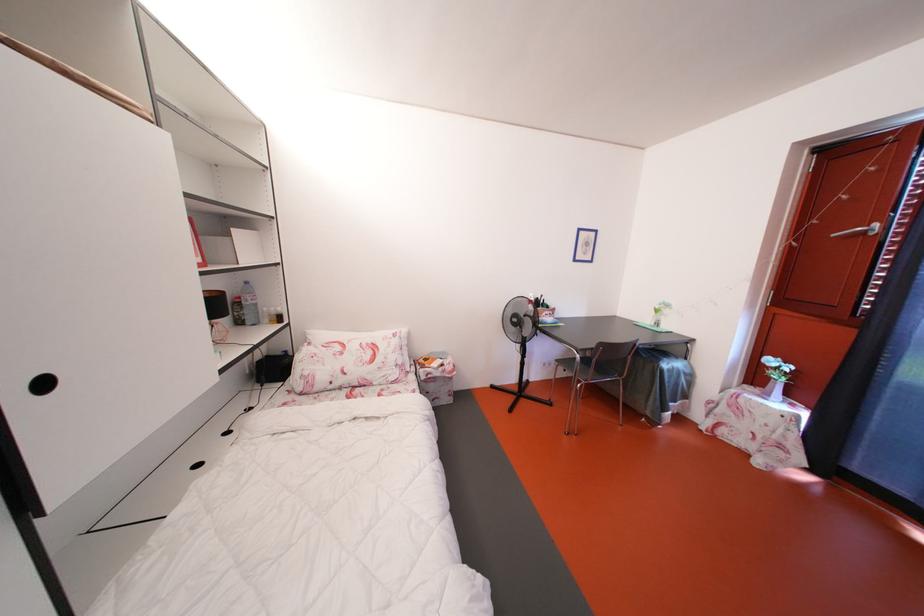
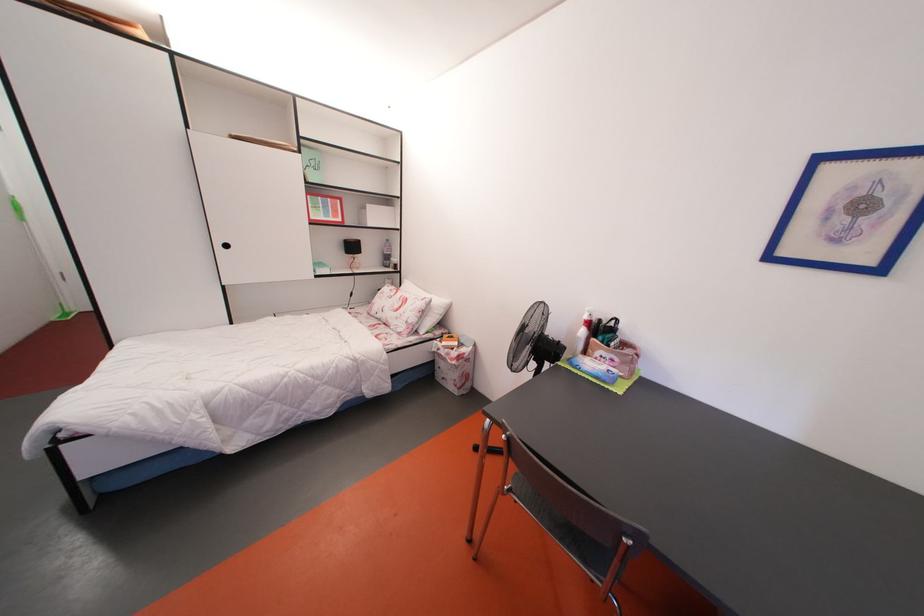
The point at (444, 379) is marked in the first image. Where is the corresponding point in the second image?

(450, 360)